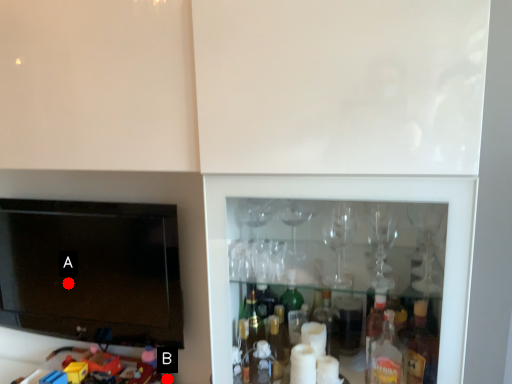
Question: Two points are circled on the image, labeled by A and B beside each circle. Among these points, which one is nearest to the camera?

Choices:
 (A) A is closer
 (B) B is closer

Answer: (B)